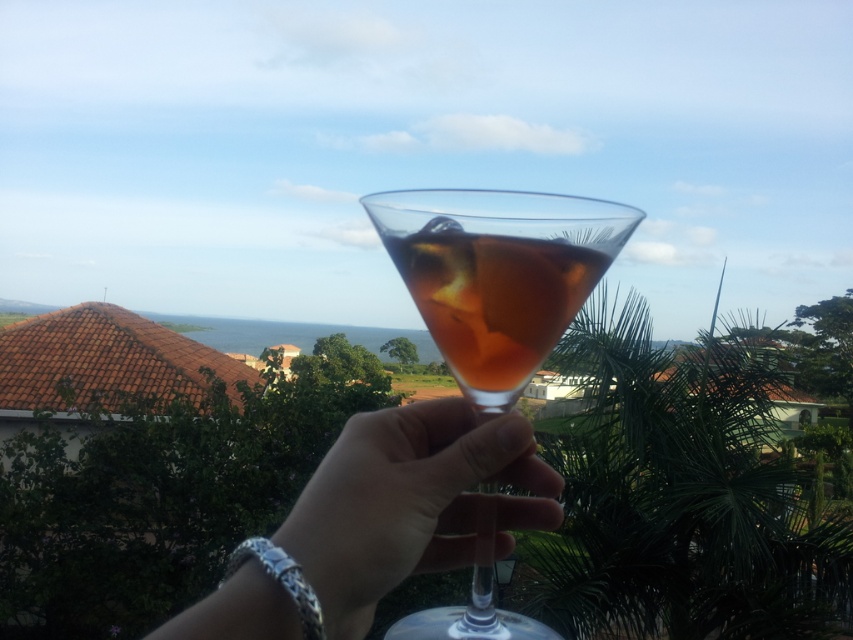
Looking at this image, you are holding a martini glass in your hand and want to place it on a table that is 10 inches away from you. Is the point at coordinates point (390, 420) within the area where you can reach to place the glass?

The point at coordinates point (390, 420) is 8.81 inches away from you, which is within the 10 inches distance required to place the glass. Therefore, you can reach that point to place the martini glass.

You are a bartender trying to place two glasses on a narrow shelf that can only accommodate items spaced 1 inch apart. Can both the translucent glass cocktail at center and the clear glass at center fit on the shelf without overlapping?

The distance between the translucent glass cocktail at center and the clear glass at center is 1.16 inches, which is greater than the 1 inch requirement. Therefore, both glasses can fit on the shelf without overlapping.

You are at a beach bar and see two drinks in front of you. One is a translucent glass cocktail at center and the other is a translucent glass drink at center. Which one is more to the left?

The translucent glass cocktail at center is more to the left than the translucent glass drink at center.